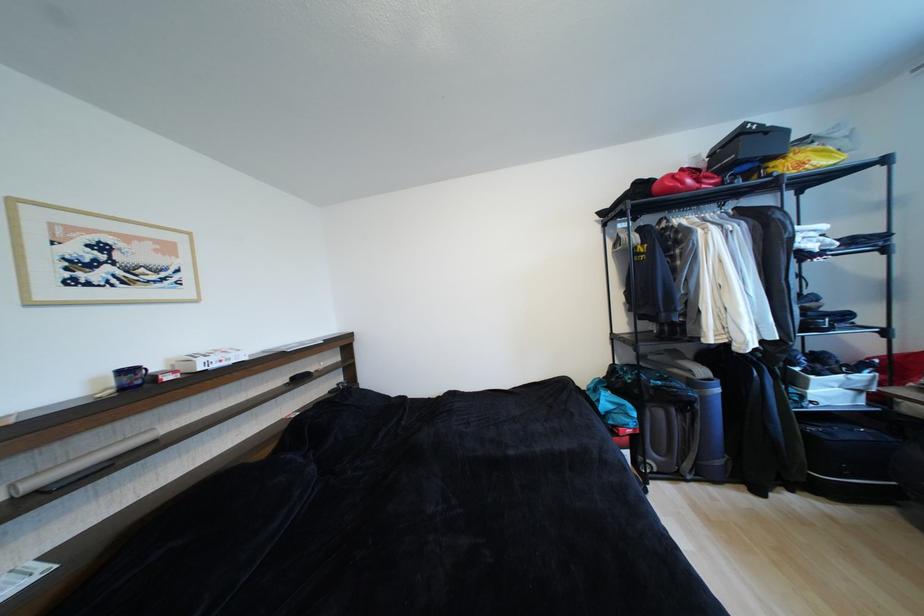
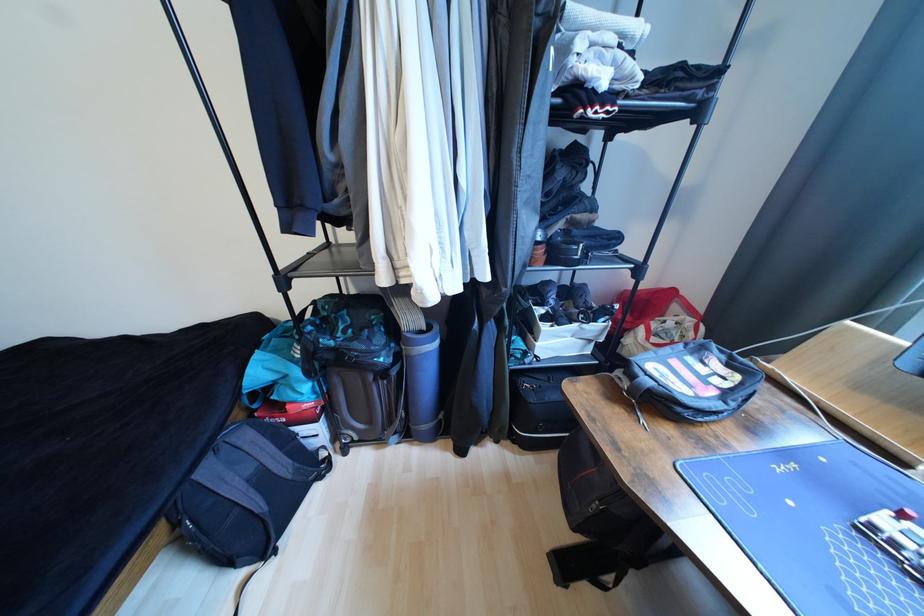
Locate, in the second image, the point that corresponds to (x=819, y=379) in the first image.

(552, 329)